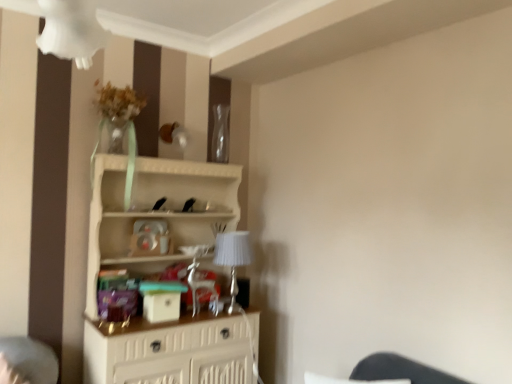
Question: Is white wood shelf at center beside transparent glass vase at upper center?

Choices:
 (A) yes
 (B) no

Answer: (B)

Question: Can you confirm if white wood shelf at center is wider than transparent glass vase at upper center?

Choices:
 (A) no
 (B) yes

Answer: (B)

Question: From a real-world perspective, is white wood shelf at center under transparent glass vase at upper center?

Choices:
 (A) yes
 (B) no

Answer: (A)

Question: Considering the relative positions of white wood shelf at center and transparent glass vase at upper center in the image provided, is white wood shelf at center behind transparent glass vase at upper center?

Choices:
 (A) no
 (B) yes

Answer: (A)

Question: Can you confirm if white wood shelf at center is smaller than transparent glass vase at upper center?

Choices:
 (A) yes
 (B) no

Answer: (B)

Question: Considering the positions of white wood shelf at center and silver metallic table lamp at center in the image, is white wood shelf at center bigger or smaller than silver metallic table lamp at center?

Choices:
 (A) big
 (B) small

Answer: (A)

Question: Choose the correct answer: Is white wood shelf at center inside silver metallic table lamp at center or outside it?

Choices:
 (A) outside
 (B) inside

Answer: (A)

Question: In terms of width, does white wood shelf at center look wider or thinner when compared to silver metallic table lamp at center?

Choices:
 (A) thin
 (B) wide

Answer: (B)

Question: From the image's perspective, is white wood shelf at center positioned above or below silver metallic table lamp at center?

Choices:
 (A) above
 (B) below

Answer: (B)

Question: Is point (123, 215) closer or farther from the camera than point (214, 147)?

Choices:
 (A) farther
 (B) closer

Answer: (B)

Question: From the image's perspective, is white wood shelf at center located above or below transparent glass vase at upper center?

Choices:
 (A) above
 (B) below

Answer: (B)

Question: Based on their sizes in the image, would you say white wood shelf at center is bigger or smaller than transparent glass vase at upper center?

Choices:
 (A) big
 (B) small

Answer: (A)

Question: In the image, is white wood shelf at center on the left side or the right side of transparent glass vase at upper center?

Choices:
 (A) left
 (B) right

Answer: (A)

Question: Based on their sizes in the image, would you say silver metallic table lamp at center is bigger or smaller than transparent glass vase at upper center?

Choices:
 (A) big
 (B) small

Answer: (A)

Question: Considering the positions of silver metallic table lamp at center and transparent glass vase at upper center in the image, is silver metallic table lamp at center wider or thinner than transparent glass vase at upper center?

Choices:
 (A) wide
 (B) thin

Answer: (A)